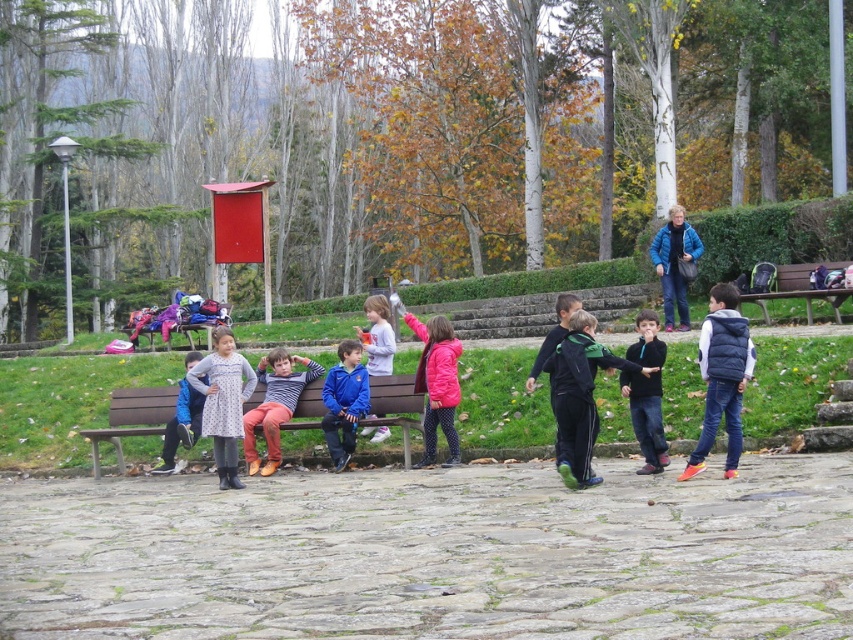
You are a photographer trying to capture a photo of the children in the park. You notice the brown wooden bench at center and the green athletic tracksuit at center. Which object takes up more space in the photo?

The green athletic tracksuit at center takes up more space in the photo because the brown wooden bench at center occupies less space than the green athletic tracksuit at center.

You are standing at the origin point in the park scene. There are two points marked in the image, point A at coordinates point (376, 400) and point B at coordinates point (573, 387). Which point is closer to you?

Point B at coordinates point (573, 387) is closer to you because it is in front of point A at coordinates point (376, 400).